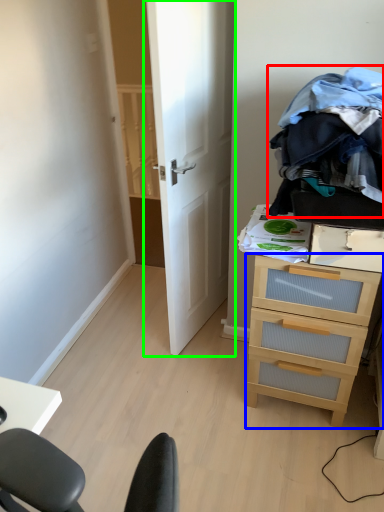
Question: Estimate the real-world distances between objects in this image. Which object is farther from clothing (highlighted by a red box), chest of drawers (highlighted by a blue box) or door (highlighted by a green box)?

Choices:
 (A) chest of drawers
 (B) door

Answer: (B)